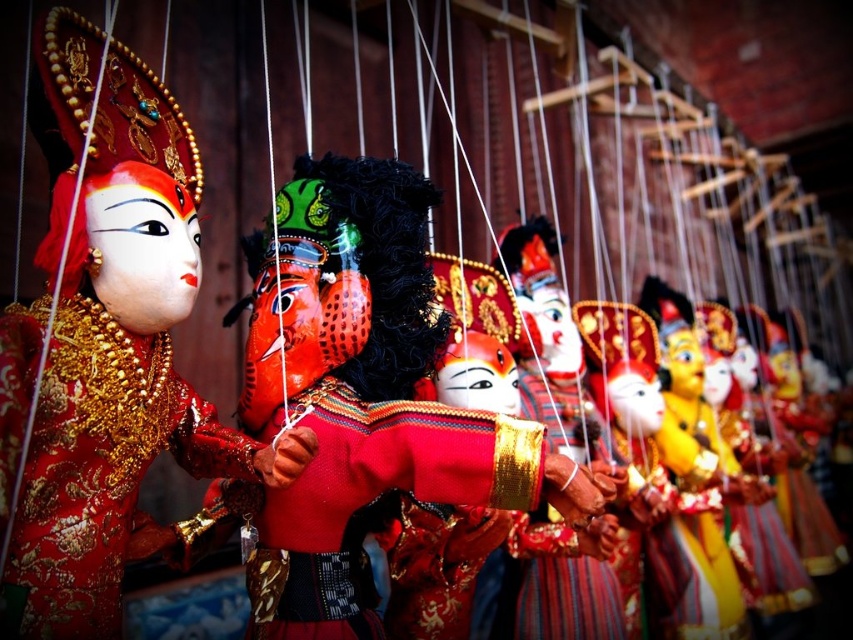
Question: Among these points, which one is farthest from the camera?

Choices:
 (A) (123, 340)
 (B) (415, 428)
 (C) (51, 90)

Answer: (B)

Question: Is matte gold mask at left positioned at the back of gold embroidered dress at center?

Choices:
 (A) yes
 (B) no

Answer: (A)

Question: Which point is farther to the camera?

Choices:
 (A) velvet red costume at center
 (B) gold embroidered dress at center

Answer: (A)

Question: In this image, where is matte gold mask at left located relative to matte red puppet at center?

Choices:
 (A) above
 (B) below

Answer: (A)

Question: Is matte red puppet at center above gold embroidered dress at center?

Choices:
 (A) no
 (B) yes

Answer: (B)

Question: Which point appears farthest from the camera in this image?

Choices:
 (A) (80, 394)
 (B) (354, 589)
 (C) (370, 184)
 (D) (106, 580)

Answer: (C)